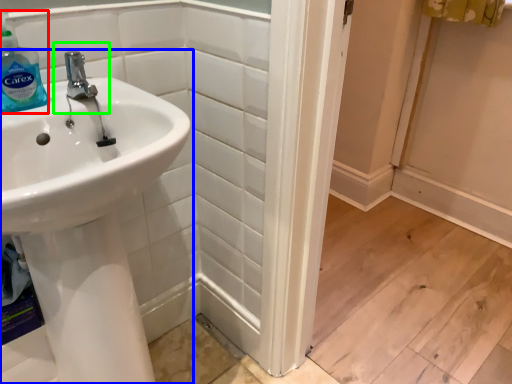
Question: Based on their relative distances, which object is nearer to cleaning product (highlighted by a red box)? Choose from sink (highlighted by a blue box) and plumbing fixture (highlighted by a green box).

Choices:
 (A) sink
 (B) plumbing fixture

Answer: (B)